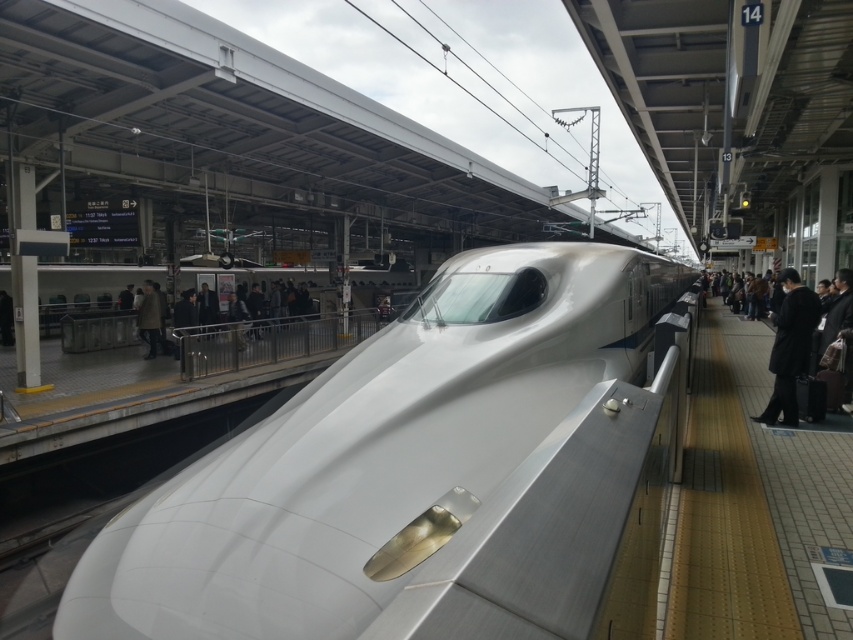
Looking at this image, does black wool coat at right have a smaller size compared to brown wool coat at center?

Yes.

Does black wool coat at right have a greater width compared to brown wool coat at center?

No.

Is point (790, 275) behind point (160, 330)?

No, (790, 275) is in front of (160, 330).

Where is `black wool coat at right`? This screenshot has width=853, height=640. black wool coat at right is located at coordinates (788, 348).

Who is higher up, white glossy bullet train at center or dark gray suit at right?

dark gray suit at right is above.

Does white glossy bullet train at center appear on the left side of dark gray suit at right?

Yes, white glossy bullet train at center is to the left of dark gray suit at right.

Is point (340, 582) closer to viewer compared to point (770, 394)?

Yes.

Find the location of `white glossy bullet train at center`. white glossy bullet train at center is located at coordinates (372, 449).

Based on the photo, is wooden platform at right thinner than brown wool coat at center?

No, wooden platform at right is not thinner than brown wool coat at center.

The width and height of the screenshot is (853, 640). What do you see at coordinates (753, 502) in the screenshot? I see `wooden platform at right` at bounding box center [753, 502].

Who is more forward, (762, 376) or (141, 336)?

Point (762, 376) is in front.

Where is `wooden platform at right`? wooden platform at right is located at coordinates (753, 502).